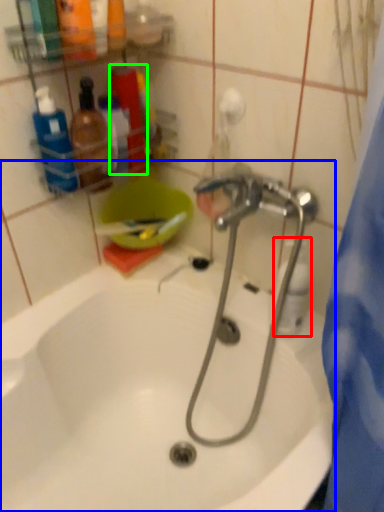
Question: Considering the real-world distances, which object is farthest from cleaning product (highlighted by a red box)? bathtub (highlighted by a blue box) or toiletry (highlighted by a green box)?

Choices:
 (A) bathtub
 (B) toiletry

Answer: (B)